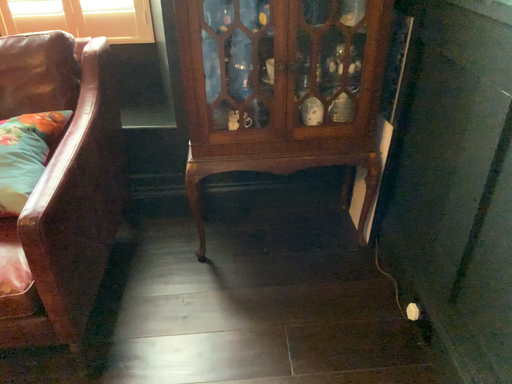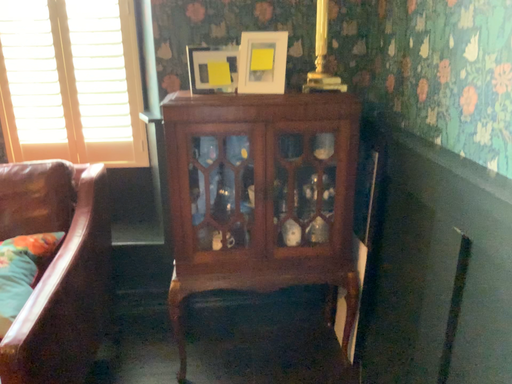
Question: Which way did the camera rotate in the video?

Choices:
 (A) rotated downward
 (B) rotated upward

Answer: (B)